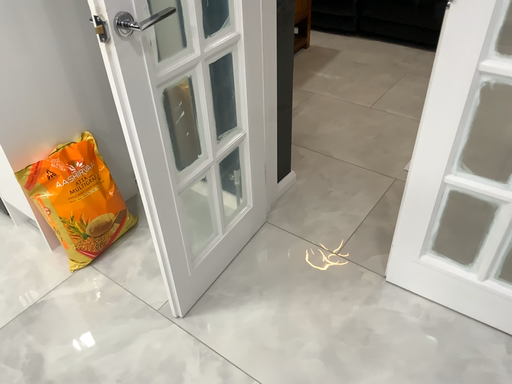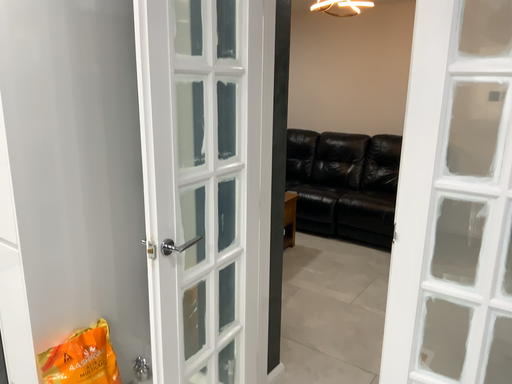
Question: How did the camera likely rotate when shooting the video?

Choices:
 (A) rotated upward
 (B) rotated downward

Answer: (A)